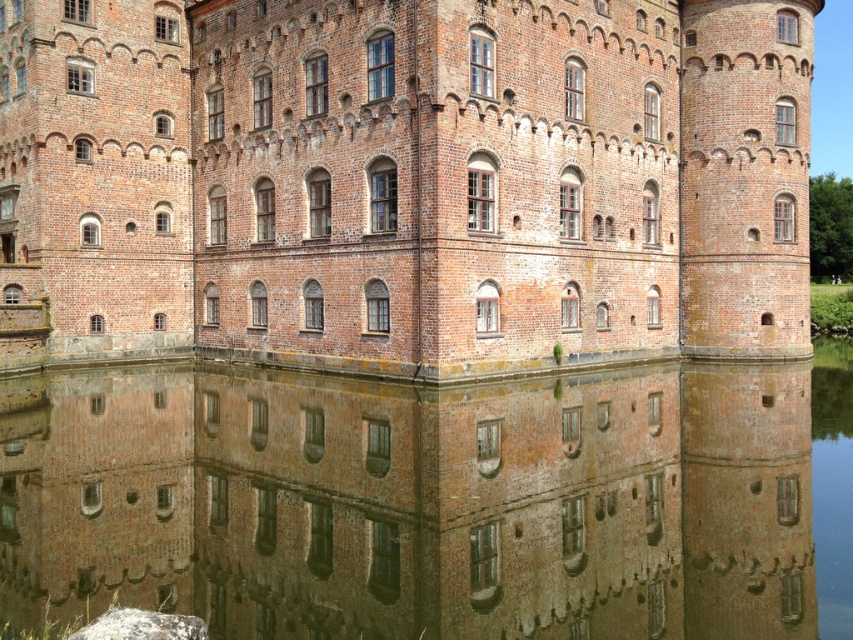
Which is more to the right, brick wall at center or brown reflective water at bottom?

From the viewer's perspective, brown reflective water at bottom appears more on the right side.

Who is taller, brick wall at center or brown reflective water at bottom?

brick wall at center

Does point (157, 202) lie in front of point (251, 609)?

No, (157, 202) is behind (251, 609).

Find the location of a particular element. Image resolution: width=853 pixels, height=640 pixels. brick wall at center is located at coordinates (404, 180).